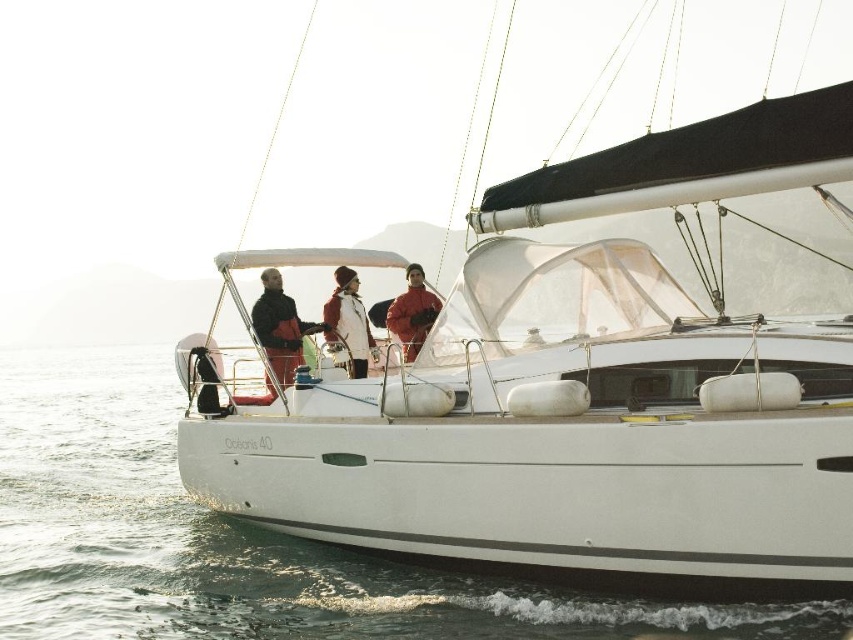
Does white woolen hat at center have a greater width compared to matte red jacket at center?

No, white woolen hat at center is not wider than matte red jacket at center.

Identify the location of white woolen hat at center. Image resolution: width=853 pixels, height=640 pixels. pyautogui.click(x=347, y=323).

Is point (352, 321) farther from camera compared to point (428, 305)?

Yes, point (352, 321) is farther from viewer.

The height and width of the screenshot is (640, 853). Find the location of `white woolen hat at center`. white woolen hat at center is located at coordinates (347, 323).

Between point (544, 609) and point (347, 337), which one is positioned behind?

The point (347, 337) is behind.

Between point (28, 358) and point (358, 369), which one is positioned in front?

Point (358, 369) is in front.

Identify the location of clear water at lower left. (242, 540).

Which of these two, matte black jacket at center or white woolen hat at center, stands taller?

white woolen hat at center is taller.

Between point (271, 349) and point (354, 368), which one is positioned behind?

Point (354, 368)

This screenshot has width=853, height=640. Identify the location of matte black jacket at center. (280, 326).